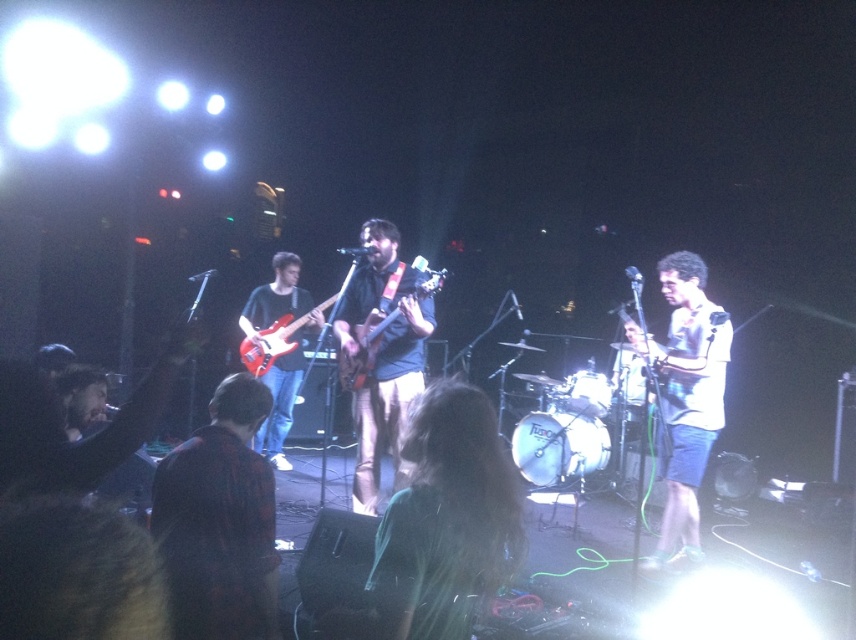
Question: Does plaid shirt at center appear on the left side of matte black electric guitar at right?

Choices:
 (A) no
 (B) yes

Answer: (B)

Question: Which object is the farthest from the white matte shirt at center?

Choices:
 (A) matte red electric guitar at center
 (B) green fabric shirt at center
 (C) shiny red electric guitar at center
 (D) plaid shirt at center

Answer: (B)

Question: Is green fabric shirt at center positioned behind matte black electric guitar at right?

Choices:
 (A) yes
 (B) no

Answer: (B)

Question: Considering the real-world distances, which object is farthest from the matte black guitar at center?

Choices:
 (A) white matte shirt at center
 (B) matte red electric guitar at center
 (C) matte black electric guitar at right
 (D) green fabric shirt at center

Answer: (C)

Question: Among these objects, which one is farthest from the camera?

Choices:
 (A) matte black electric guitar at right
 (B) shiny red electric guitar at center
 (C) green fabric shirt at center

Answer: (A)

Question: Can you confirm if plaid shirt at center is positioned below white matte shirt at center?

Choices:
 (A) yes
 (B) no

Answer: (A)